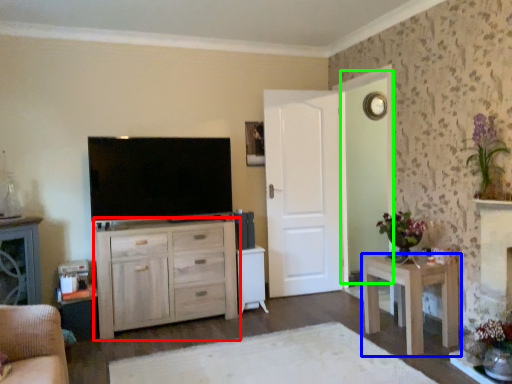
Question: Estimate the real-world distances between objects in this image. Which object is closer to chest of drawers (highlighted by a red box), nightstand (highlighted by a blue box) or glass door (highlighted by a green box)?

Choices:
 (A) nightstand
 (B) glass door

Answer: (A)